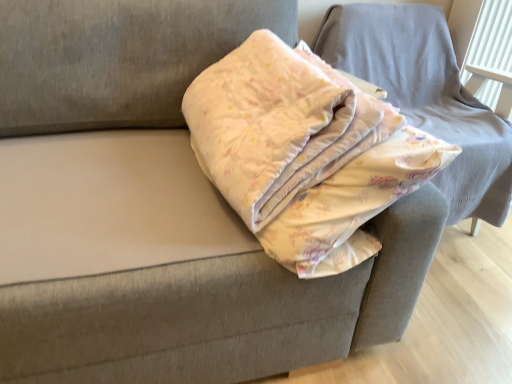
Question: Would you say floral cotton blanket at upper right is to the left or to the right of fluffy cotton blanket at center in the picture?

Choices:
 (A) left
 (B) right

Answer: (B)

Question: Is floral cotton blanket at upper right spatially inside fluffy cotton blanket at center, or outside of it?

Choices:
 (A) outside
 (B) inside

Answer: (A)

Question: From a real-world perspective, is floral cotton blanket at upper right positioned above or below fluffy cotton blanket at center?

Choices:
 (A) below
 (B) above

Answer: (A)

Question: Is fluffy cotton blanket at center wider or thinner than floral cotton blanket at upper right?

Choices:
 (A) thin
 (B) wide

Answer: (B)

Question: From the image's perspective, is fluffy cotton blanket at center above or below floral cotton blanket at upper right?

Choices:
 (A) above
 (B) below

Answer: (B)

Question: Is fluffy cotton blanket at center bigger or smaller than floral cotton blanket at upper right?

Choices:
 (A) big
 (B) small

Answer: (B)

Question: From a real-world perspective, is fluffy cotton blanket at center physically located above or below floral cotton blanket at upper right?

Choices:
 (A) below
 (B) above

Answer: (B)